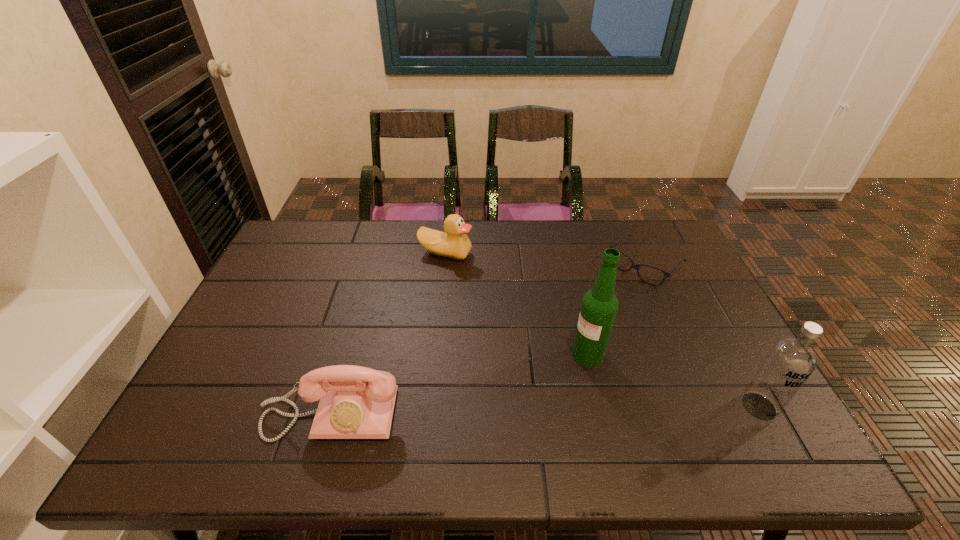
The height and width of the screenshot is (540, 960). In order to click on vacant point located between the vodka and the spectacles in this screenshot , I will do `click(702, 336)`.

Identify the location of free point between the spectacles and the vodka. (702, 336).

Locate an element on the screen. This screenshot has height=540, width=960. empty location between the vodka and the shortest object is located at coordinates (702, 336).

Where is `empty space between the vodka and the third object from right to left`? The image size is (960, 540). empty space between the vodka and the third object from right to left is located at coordinates (673, 381).

This screenshot has width=960, height=540. Find the location of `empty space between the duck and the spectacles`. empty space between the duck and the spectacles is located at coordinates (545, 259).

Where is `unoccupied position between the tallest object and the second tallest object`? This screenshot has width=960, height=540. unoccupied position between the tallest object and the second tallest object is located at coordinates (673, 381).

Locate an element on the screen. The image size is (960, 540). free space between the shortest object and the vodka is located at coordinates (702, 336).

The height and width of the screenshot is (540, 960). I want to click on the second closest object to the second tallest object, so click(636, 266).

Identify the location of the fourth closest object to the second tallest object. The width and height of the screenshot is (960, 540). (454, 243).

This screenshot has width=960, height=540. In order to click on vacant space that satisfies the following two spatial constraints: 1. on the front side of the duck; 2. on the left side of the third farthest object in this screenshot , I will do (436, 355).